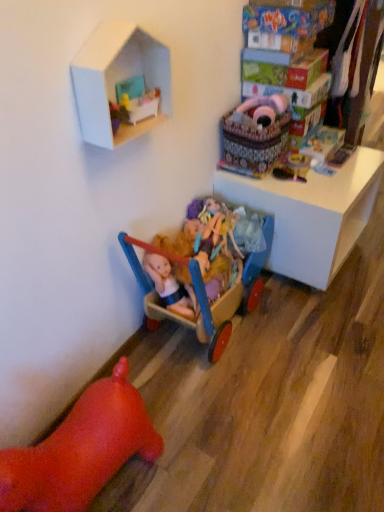
Find the location of a particular element. This screenshot has width=384, height=512. free space above white glossy table at upper right (from a real-world perspective) is located at coordinates (332, 174).